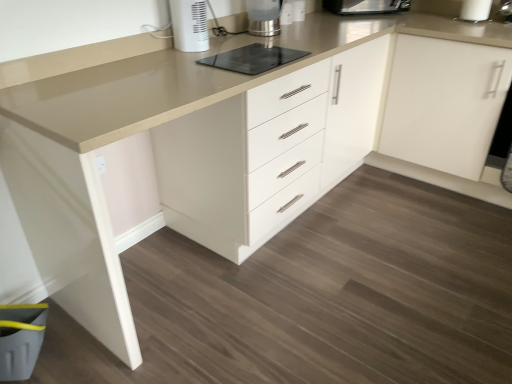
Question: Is point (238, 61) positioned closer to the camera than point (271, 4)?

Choices:
 (A) closer
 (B) farther

Answer: (A)

Question: From a real-world perspective, is black glass cooktop at center positioned above or below metallic silver kettle at upper center, which is the 2th home appliance from left to right?

Choices:
 (A) below
 (B) above

Answer: (A)

Question: Considering the real-world distances, which object is closest to the black glass cooktop at center?

Choices:
 (A) white matte cabinet at upper right
 (B) white plastic heater at upper center, which is counted as the first home appliance, starting from the left
 (C) metallic silver kettle at upper center, the first home appliance in the right-to-left sequence
 (D) metallic stainless steel toaster at upper center

Answer: (B)

Question: Estimate the real-world distances between objects in this image. Which object is farther from the metallic stainless steel toaster at upper center?

Choices:
 (A) white matte cabinet at upper right
 (B) white plastic heater at upper center, arranged as the second home appliance when viewed from the back
 (C) metallic silver kettle at upper center, the first home appliance positioned from the back
 (D) black glass cooktop at center

Answer: (B)